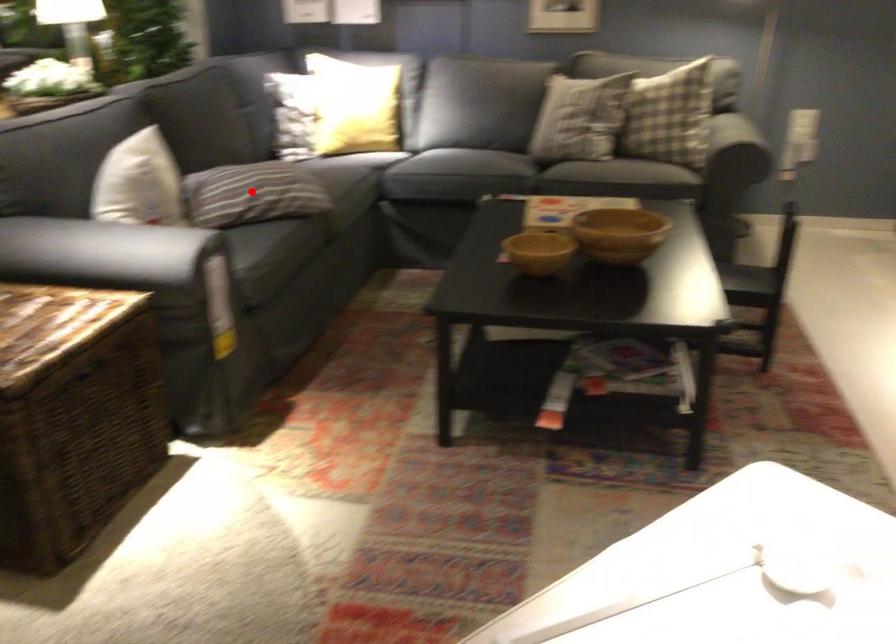
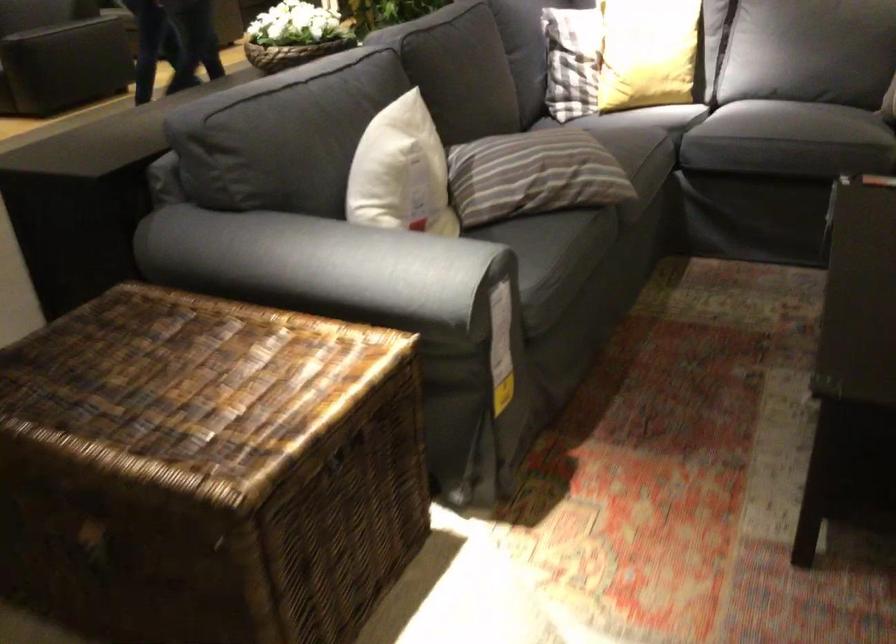
Question: I am providing you with two images of the same scene from different viewpoints. A red point is shown in image1. For the corresponding object point in image2, is it positioned nearer or farther from the camera?

Choices:
 (A) Nearer
 (B) Farther

Answer: (A)